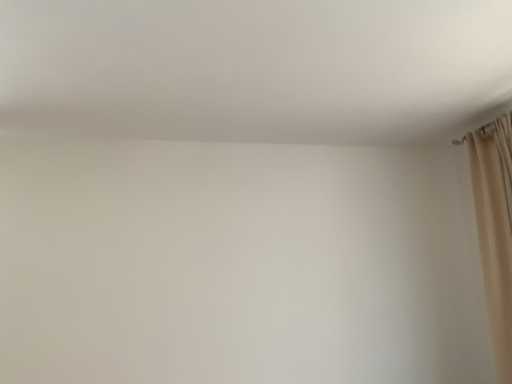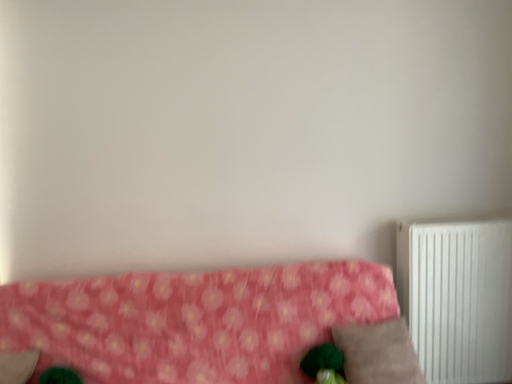
Question: Which way did the camera rotate in the video?

Choices:
 (A) rotated upward
 (B) rotated downward

Answer: (B)